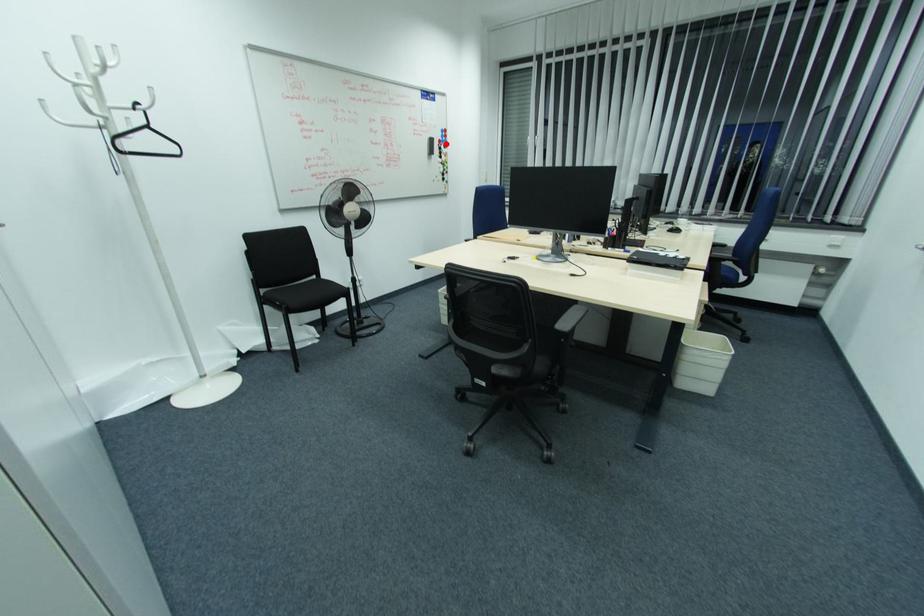
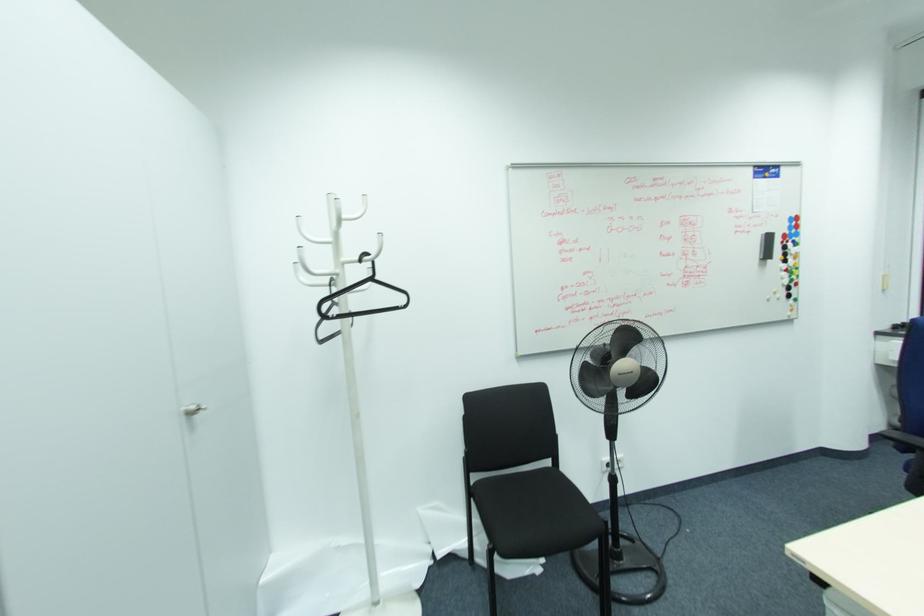
Question: I am providing you with two images of the same scene from different viewpoints. Given a red point in image1, look at the same physical point in image2. Is it:

Choices:
 (A) Closer to the viewpoint
 (B) Farther from the viewpoint

Answer: (B)